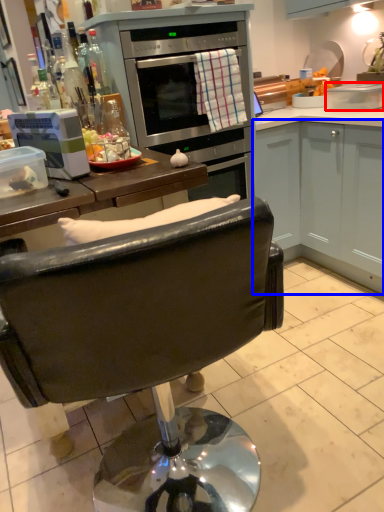
Question: Which object appears farthest to the camera in this image, pot/pan (highlighted by a red box) or cabinetry (highlighted by a blue box)?

Choices:
 (A) pot/pan
 (B) cabinetry

Answer: (A)